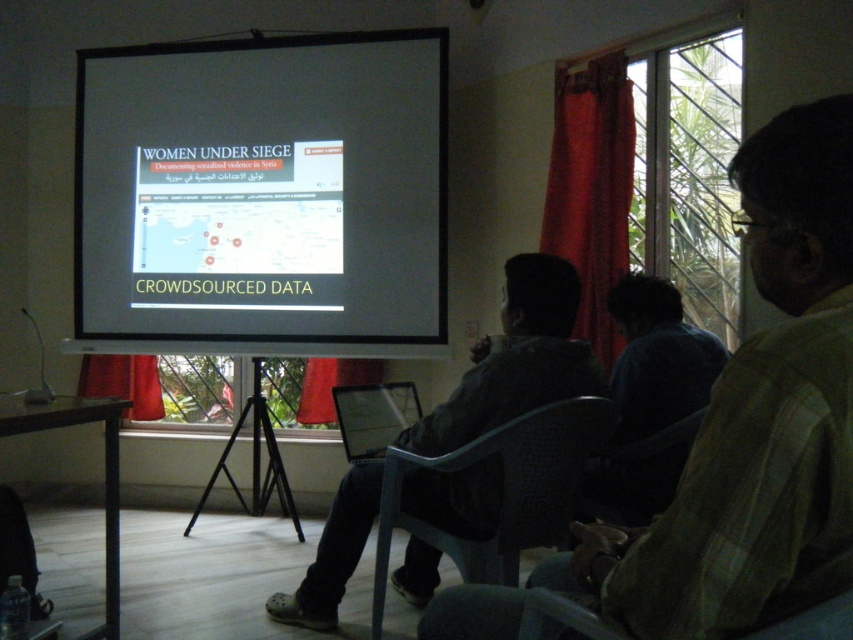
Which is above, light brown shirt at center or dark gray plastic chair at center?

light brown shirt at center

Is point (813, 364) positioned after point (402, 433)?

No, it is in front of (402, 433).

Where is `light brown shirt at center`? Image resolution: width=853 pixels, height=640 pixels. light brown shirt at center is located at coordinates (755, 420).

Is point (177, 237) more distant than point (630, 634)?

That is True.

Measure the distance between white matte projection screen at center and camera.

The distance of white matte projection screen at center from camera is 3.89 meters.

Where is `white matte projection screen at center`? white matte projection screen at center is located at coordinates (262, 195).

Which is more to the right, plastic at center or matte plastic chair at lower right?

From the viewer's perspective, matte plastic chair at lower right appears more on the right side.

This screenshot has height=640, width=853. I want to click on plastic at center, so click(503, 493).

Find the location of a particular element. The image size is (853, 640). plastic at center is located at coordinates (503, 493).